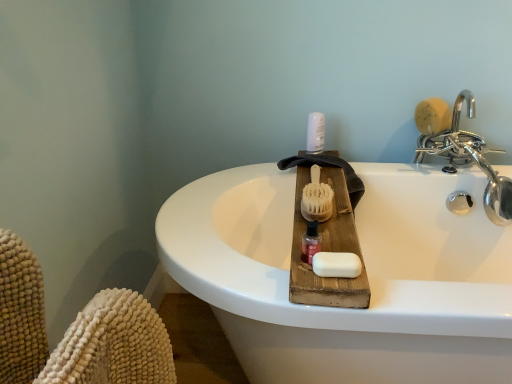
Describe the element at coordinates (315, 133) in the screenshot. I see `white plastic bottle at upper center` at that location.

Find the location of a particular element. This screenshot has width=512, height=384. white matte soap at center is located at coordinates (336, 264).

What are the coordinates of `toiletry above the wooden bristle brush at center, acting as the second brush starting from the right (from a real-world perspective)` in the screenshot? It's located at (315, 133).

What's the angular difference between white plastic bottle at upper center and wooden bristle brush at center, which is counted as the first brush, starting from the front,'s facing directions?

They differ by 0.00233 degrees in their facing directions.

From the image's perspective, which is above, white plastic bottle at upper center or wooden bristle brush at center, acting as the second brush starting from the right?

white plastic bottle at upper center appears higher in the image.

Is white plastic bottle at upper center far from wooden bristle brush at center, acting as the second brush starting from the right?

They are positioned close to each other.

Between pink glossy bottle at center and natural wood brush at upper right, marked as the first brush in a right-to-left arrangement, which one has smaller size?

Smaller between the two is pink glossy bottle at center.

From a real-world perspective, between pink glossy bottle at center and natural wood brush at upper right, marked as the first brush in a right-to-left arrangement, who is vertically lower?

pink glossy bottle at center.

From the image's perspective, which object appears higher, pink glossy bottle at center or natural wood brush at upper right, positioned as the second brush in left-to-right order?

natural wood brush at upper right, positioned as the second brush in left-to-right order, is shown above in the image.

Does pink glossy bottle at center contain natural wood brush at upper right, marked as the 1th brush in a back-to-front arrangement?

That's incorrect, natural wood brush at upper right, marked as the 1th brush in a back-to-front arrangement, is not inside pink glossy bottle at center.

From the image's perspective, which is below, chrome metallic faucet at upper right or wooden bristle brush at center, the 2th brush from the back?

wooden bristle brush at center, the 2th brush from the back.

Choose the correct answer: Is chrome metallic faucet at upper right inside wooden bristle brush at center, the 1th brush in the left-to-right sequence, or outside it?

chrome metallic faucet at upper right is outside wooden bristle brush at center, the 1th brush in the left-to-right sequence.

Does chrome metallic faucet at upper right have a greater width compared to wooden bristle brush at center, which is counted as the first brush, starting from the front?

In fact, chrome metallic faucet at upper right might be narrower than wooden bristle brush at center, which is counted as the first brush, starting from the front.

From a real-world perspective, which is physically above, natural wood brush at upper right, placed as the 2th brush when sorted from front to back, or white plastic bottle at upper center?

natural wood brush at upper right, placed as the 2th brush when sorted from front to back, is physically above.

Is natural wood brush at upper right, placed as the 2th brush when sorted from front to back, taller or shorter than white plastic bottle at upper center?

Clearly, natural wood brush at upper right, placed as the 2th brush when sorted from front to back, is shorter compared to white plastic bottle at upper center.

Which is more to the left, natural wood brush at upper right, marked as the 1th brush in a back-to-front arrangement, or white plastic bottle at upper center?

white plastic bottle at upper center.

Could you tell me if natural wood brush at upper right, the 1th brush from the top, is facing white plastic bottle at upper center?

No, natural wood brush at upper right, the 1th brush from the top, is not turned towards white plastic bottle at upper center.

How much distance is there between natural wood brush at upper right, positioned as the second brush in left-to-right order, and white matte soap at center?

natural wood brush at upper right, positioned as the second brush in left-to-right order, and white matte soap at center are 82.58 centimeters apart.

Does natural wood brush at upper right, the 2th brush ordered from the bottom, have a greater width compared to white matte soap at center?

Yes.

Which object is positioned more to the right, natural wood brush at upper right, marked as the first brush in a right-to-left arrangement, or white matte soap at center?

From the viewer's perspective, natural wood brush at upper right, marked as the first brush in a right-to-left arrangement, appears more on the right side.

From a real-world perspective, is natural wood brush at upper right, marked as the first brush in a right-to-left arrangement, below white matte soap at center?

No, from a real-world perspective, natural wood brush at upper right, marked as the first brush in a right-to-left arrangement, is not below white matte soap at center.

Is white matte soap at center completely or partially outside of chrome metallic faucet at upper right?

Yes.

In the scene shown: Which object is positioned more to the right, white matte soap at center or chrome metallic faucet at upper right?

chrome metallic faucet at upper right is more to the right.

Considering the sizes of objects white matte soap at center and chrome metallic faucet at upper right in the image provided, who is bigger, white matte soap at center or chrome metallic faucet at upper right?

chrome metallic faucet at upper right is bigger.

From a real-world perspective, is white matte soap at center over chrome metallic faucet at upper right?

Yes, from a real-world perspective, white matte soap at center is on top of chrome metallic faucet at upper right.

Considering the positions of point (322, 202) and point (419, 116), is point (322, 202) closer or farther from the camera than point (419, 116)?

Point (322, 202) is closer to the camera than point (419, 116).

Does wooden bristle brush at center, acting as the second brush starting from the right, contain natural wood brush at upper right, marked as the 1th brush in a back-to-front arrangement?

No, natural wood brush at upper right, marked as the 1th brush in a back-to-front arrangement, is not surrounded by wooden bristle brush at center, acting as the second brush starting from the right.

Would you say wooden bristle brush at center, which appears as the second brush when viewed from the top, is to the left or to the right of natural wood brush at upper right, the 1th brush from the top, in the picture?

From the image, it's evident that wooden bristle brush at center, which appears as the second brush when viewed from the top, is to the left of natural wood brush at upper right, the 1th brush from the top.

From the picture: Is wooden bristle brush at center, which appears as the second brush when viewed from the top, taller than natural wood brush at upper right, the 1th brush from the top?

No.

Locate an element on the screen. Image resolution: width=512 pixels, height=384 pixels. toiletry above the wooden bristle brush at center, marked as the first brush in a bottom-to-top arrangement (from a real-world perspective) is located at coordinates (315, 133).

At what (x,y) coordinates should I click in order to perform the action: click on mouthwash located underneath the natural wood brush at upper right, positioned as the second brush in left-to-right order (from a real-world perspective). Please return your answer as a coordinate pair (x, y). The image size is (512, 384). Looking at the image, I should click on pos(311,242).

Which object lies nearer to the anchor point chrome metallic faucet at upper right, natural wood brush at upper right, positioned as the second brush in left-to-right order, or pink glossy bottle at center?

natural wood brush at upper right, positioned as the second brush in left-to-right order, lies closer to chrome metallic faucet at upper right than the other object.

Based on their spatial positions, is chrome metallic faucet at upper right or natural wood brush at upper right, positioned as the second brush in left-to-right order, closer to white matte soap at center?

natural wood brush at upper right, positioned as the second brush in left-to-right order, is positioned closer to the anchor white matte soap at center.

Based on the photo, which object lies further to the anchor point chrome metallic faucet at upper right, white matte soap at center or natural wood brush at upper right, positioned as the second brush in left-to-right order?

white matte soap at center.

When comparing their distances from pink glossy bottle at center, does chrome metallic faucet at upper right or wooden bristle brush at center, acting as the second brush starting from the right, seem closer?

Among the two, wooden bristle brush at center, acting as the second brush starting from the right, is located nearer to pink glossy bottle at center.

From the image, which object appears to be nearer to wooden bristle brush at center, marked as the first brush in a bottom-to-top arrangement, white plastic bottle at upper center or chrome metallic faucet at upper right?

Among the two, white plastic bottle at upper center is located nearer to wooden bristle brush at center, marked as the first brush in a bottom-to-top arrangement.

When comparing their distances from wooden bristle brush at center, which is counted as the first brush, starting from the front, does white matte soap at center or natural wood brush at upper right, the 2th brush ordered from the bottom, seem further?

natural wood brush at upper right, the 2th brush ordered from the bottom.

Estimate the real-world distances between objects in this image. Which object is further from white plastic bottle at upper center, white matte soap at center or pink glossy bottle at center?

Among the two, white matte soap at center is located further to white plastic bottle at upper center.

Consider the image. Considering their positions, is natural wood brush at upper right, positioned as the second brush in left-to-right order, positioned closer to chrome metallic faucet at upper right than white plastic bottle at upper center?

Based on the image, natural wood brush at upper right, positioned as the second brush in left-to-right order, appears to be nearer to chrome metallic faucet at upper right.

What are the coordinates of `toiletry between white matte soap at center and chrome metallic faucet at upper right` in the screenshot? It's located at (315, 133).

Image resolution: width=512 pixels, height=384 pixels. I want to click on brush positioned between pink glossy bottle at center and white plastic bottle at upper center from near to far, so click(x=317, y=198).

What are the coordinates of `toiletry located between wooden bristle brush at center, marked as the first brush in a bottom-to-top arrangement, and natural wood brush at upper right, the 1th brush from the top, in the left-right direction` in the screenshot? It's located at (315, 133).

This screenshot has width=512, height=384. In order to click on toiletry located between white matte soap at center and natural wood brush at upper right, the 1th brush from the top, in the depth direction in this screenshot , I will do `click(315, 133)`.